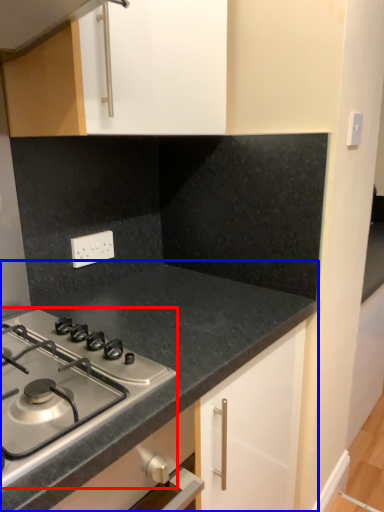
Question: Which point is further to the camera, gas stove (highlighted by a red box) or countertop (highlighted by a blue box)?

Choices:
 (A) gas stove
 (B) countertop

Answer: (B)